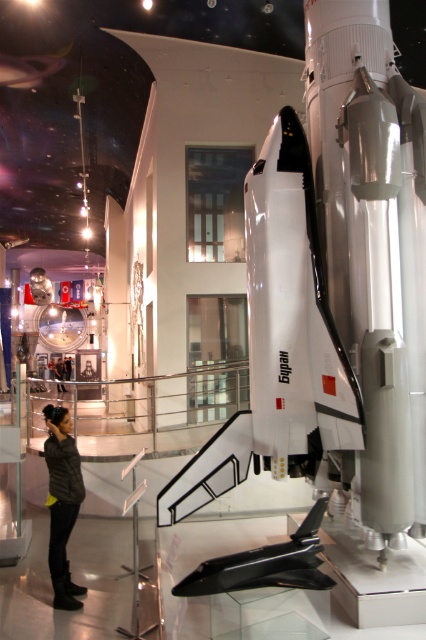
Question: Is white matte space shuttle at center bigger than black leather jacket at lower left?

Choices:
 (A) yes
 (B) no

Answer: (B)

Question: Which of the following is the farthest from the observer?

Choices:
 (A) white matte space shuttle at center
 (B) black leather jacket at lower left
 (C) dark gray leather jacket at lower left

Answer: (B)

Question: Which point is closer to the camera taking this photo?

Choices:
 (A) (204, 476)
 (B) (65, 449)

Answer: (A)

Question: Which object is the closest to the black leather jacket at lower left?

Choices:
 (A) white matte space shuttle at center
 (B) dark gray leather jacket at lower left

Answer: (B)

Question: Does white matte space shuttle at center have a lesser width compared to dark gray leather jacket at lower left?

Choices:
 (A) no
 (B) yes

Answer: (A)

Question: Is white matte space shuttle at center above black leather jacket at lower left?

Choices:
 (A) yes
 (B) no

Answer: (A)